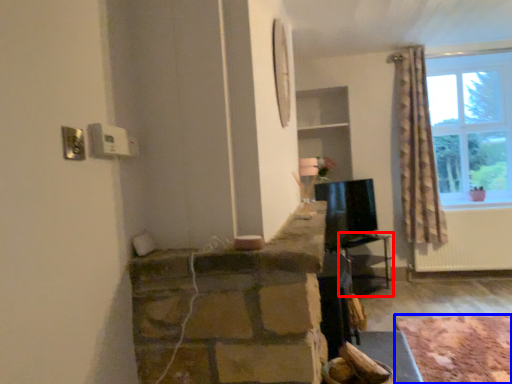
Question: Which object appears farthest to the camera in this image, table (highlighted by a red box) or plain (highlighted by a blue box)?

Choices:
 (A) table
 (B) plain

Answer: (A)